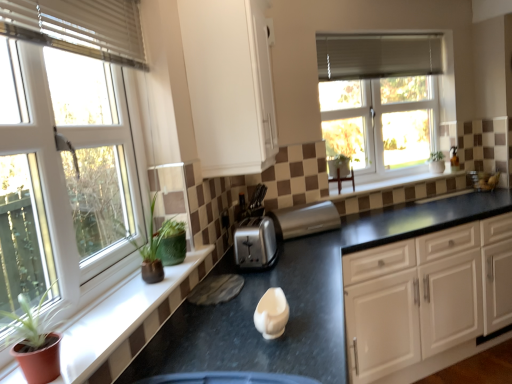
Question: Is black granite countertop at center in front of or behind green matte plant at left in the image?

Choices:
 (A) behind
 (B) front

Answer: (B)

Question: From the image's perspective, is black granite countertop at center above or below green matte plant at left?

Choices:
 (A) above
 (B) below

Answer: (B)

Question: Which is nearer to the satin silver toaster at center, the second appliance viewed from the right?

Choices:
 (A) brown tile at upper center
 (B) white fabric blind at upper right, which is counted as the 2th blind, starting from the bottom
 (C) green matte plant at left
 (D) matte green plant at left
 (E) satin silver toaster at center, arranged as the first appliance when viewed from the right

Answer: (C)

Question: Estimate the real-world distances between objects in this image. Which object is farther from the matte glass window at upper right, which is counted as the 1th window, starting from the back?

Choices:
 (A) green matte plant at left
 (B) satin silver toaster at center, marked as the 1th appliance in a front-to-back arrangement
 (C) matte green plant at left
 (D) brown tile at upper center
 (E) white plastic window at left, which is counted as the second window, starting from the back

Answer: (C)